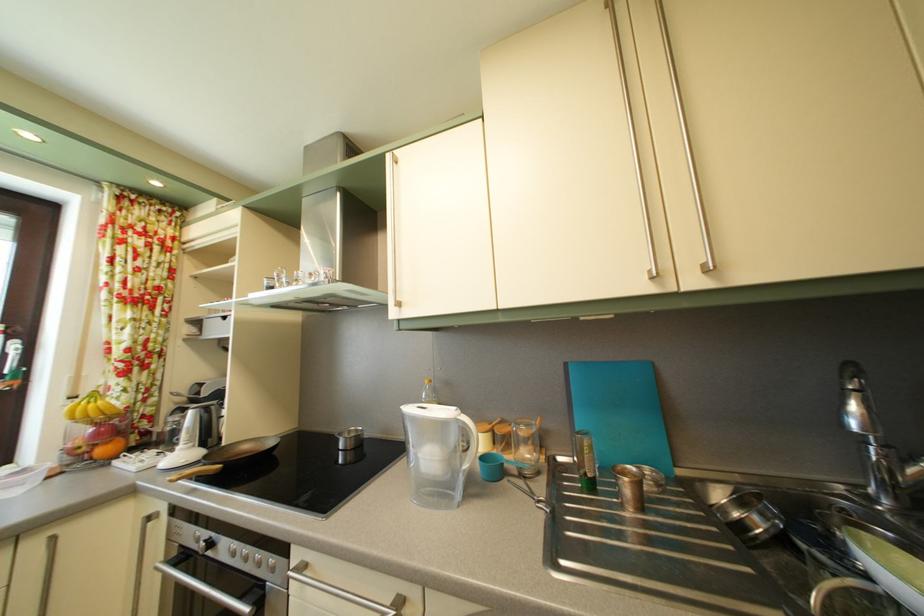
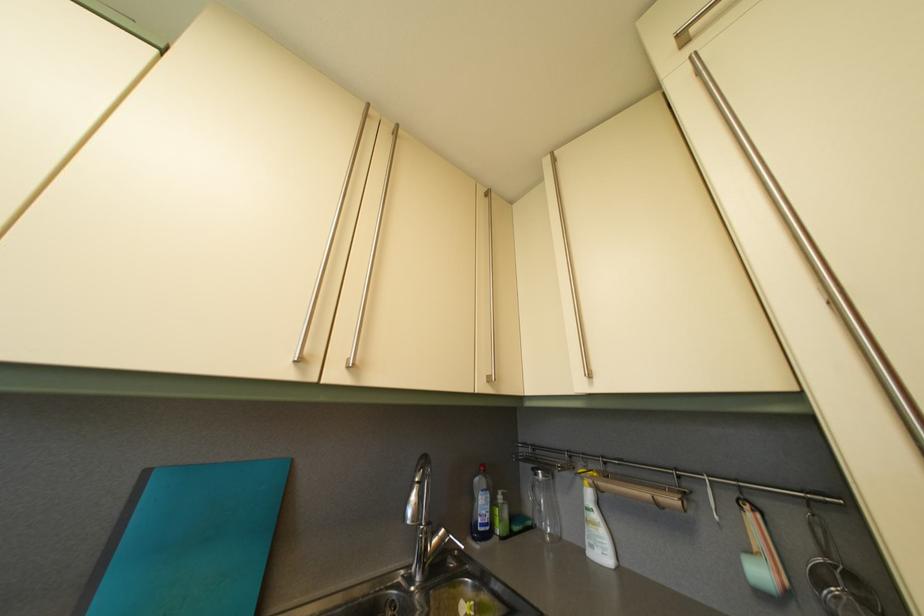
How did the camera likely rotate?

The rotation direction of the camera is right-up.